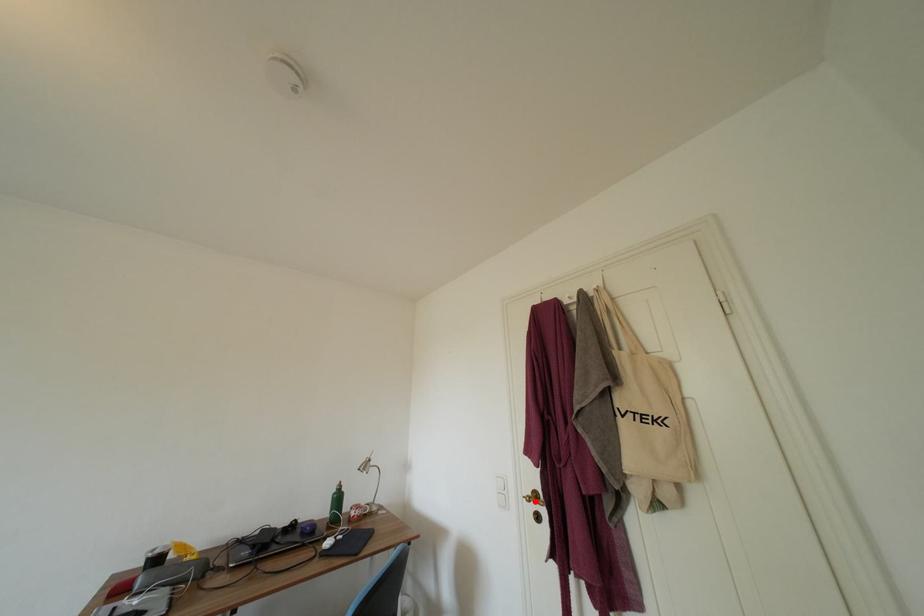
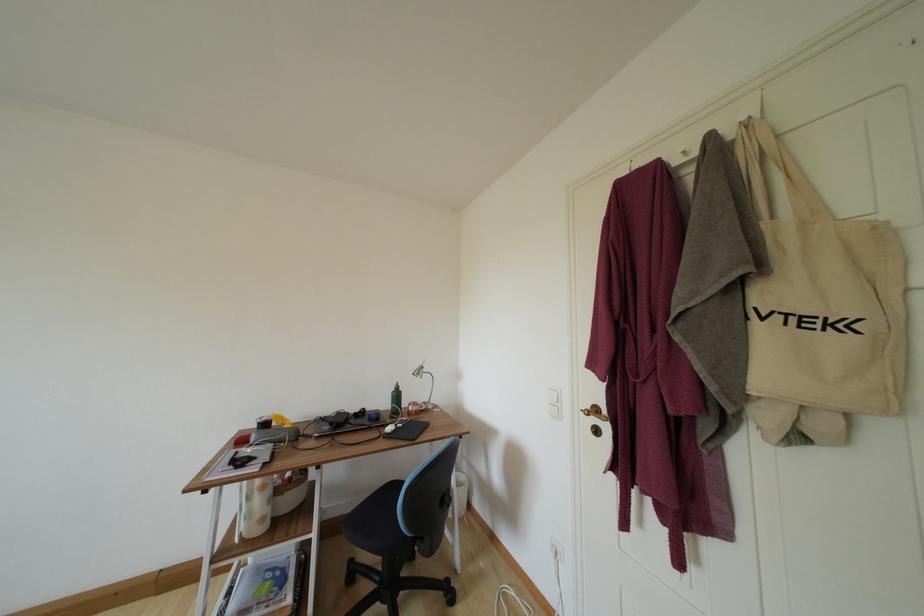
The point at the highlighted location is marked in the first image. Where is the corresponding point in the second image?

(593, 416)